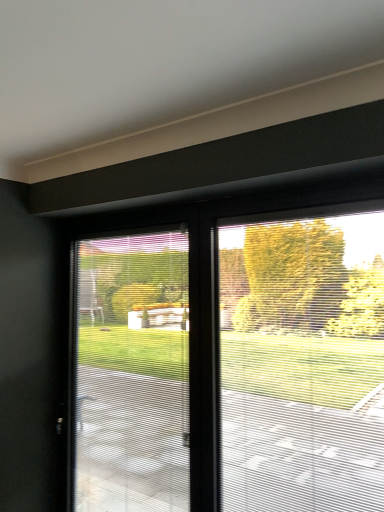
Question: From a real-world perspective, relative to frosted glass window screen at center, which ranks as the second window screen in left-to-right order, is clear plastic window screen at center, which is counted as the second window screen, starting from the right, vertically above or below?

Choices:
 (A) above
 (B) below

Answer: (B)

Question: Which is correct: clear plastic window screen at center, which is the 1th window screen from left to right, is inside frosted glass window screen at center, the first window screen when ordered from right to left, or outside of it?

Choices:
 (A) outside
 (B) inside

Answer: (A)

Question: In terms of height, does clear plastic window screen at center, which is counted as the second window screen, starting from the right, look taller or shorter compared to frosted glass window screen at center, which ranks as the second window screen in left-to-right order?

Choices:
 (A) short
 (B) tall

Answer: (B)

Question: From a real-world perspective, is frosted glass window screen at center, the first window screen when ordered from right to left, above or below clear plastic window screen at center, which is counted as the second window screen, starting from the right?

Choices:
 (A) below
 (B) above

Answer: (B)

Question: In terms of height, does frosted glass window screen at center, which ranks as the second window screen in left-to-right order, look taller or shorter compared to clear plastic window screen at center, which is counted as the second window screen, starting from the right?

Choices:
 (A) short
 (B) tall

Answer: (A)

Question: In terms of size, does frosted glass window screen at center, the first window screen when ordered from right to left, appear bigger or smaller than clear plastic window screen at center, which is the 1th window screen from left to right?

Choices:
 (A) small
 (B) big

Answer: (A)

Question: Which is correct: frosted glass window screen at center, the first window screen when ordered from right to left, is inside clear plastic window screen at center, which is the 1th window screen from left to right, or outside of it?

Choices:
 (A) inside
 (B) outside

Answer: (B)